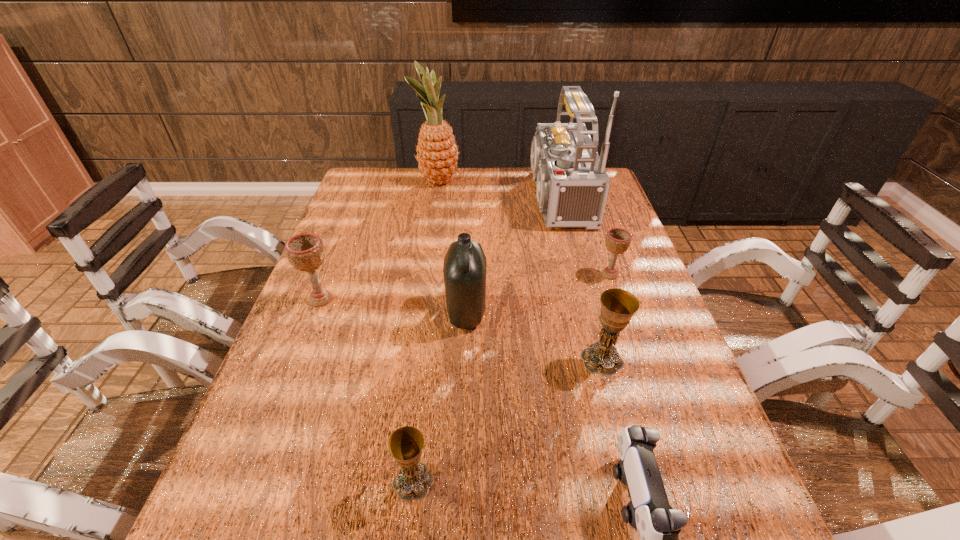
Locate an element on the screen. This screenshot has height=540, width=960. the second chalice from left to right is located at coordinates (413, 481).

Where is `blank area located 0.250m on the right of the pineapple`? blank area located 0.250m on the right of the pineapple is located at coordinates (531, 181).

This screenshot has width=960, height=540. Find the location of `vacant region located on the front-facing side of the gray radio receiver`. vacant region located on the front-facing side of the gray radio receiver is located at coordinates (422, 198).

At what (x,y) coordinates should I click in order to perform the action: click on vacant region located 0.160m on the front-facing side of the gray radio receiver. Please return your answer as a coordinate pair (x, y). Looking at the image, I should click on (467, 198).

This screenshot has height=540, width=960. Find the location of `free space located on the front-facing side of the gray radio receiver`. free space located on the front-facing side of the gray radio receiver is located at coordinates (475, 198).

Where is `free space located on the left of the sixth shortest object`? free space located on the left of the sixth shortest object is located at coordinates (366, 312).

Where is `free region located 0.100m on the front of the farther gold chalice`? The height and width of the screenshot is (540, 960). free region located 0.100m on the front of the farther gold chalice is located at coordinates tap(618, 419).

I want to click on vacant region located on the front of the bigger beige chalice, so click(266, 440).

The height and width of the screenshot is (540, 960). Identify the location of free region located on the back of the rightmost chalice. (600, 247).

In order to click on free space located on the left of the smaller gold chalice in this screenshot , I will do `click(330, 482)`.